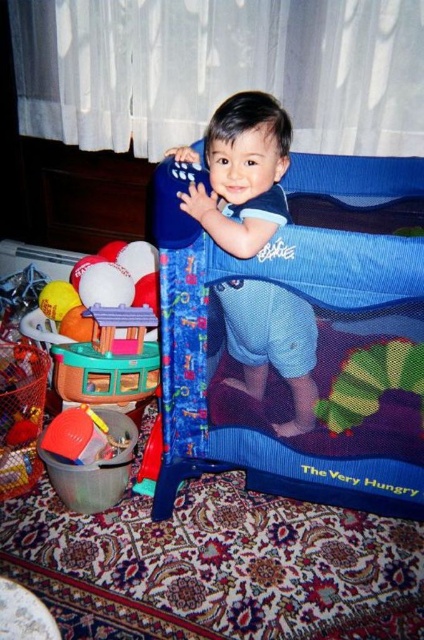
You are a parent trying to choose between the blue fabric playpen at center and the blue mesh playpen at center for your child. Based on the scene description, which playpen offers more space for the child to move around inside?

The blue fabric playpen at center has a larger size compared to the blue mesh playpen at center, so it offers more space for the child to move around inside.

You are a parent trying to clean up the play area. You see the blue fabric playpen at center and the blue mesh playpen at center. Which one is situated lower in the image?

The blue fabric playpen at center is situated lower because it is located below the blue mesh playpen at center.

You are a parent trying to place a new toy in the playpen. The playpen is at the center of the image. Where is the point at coordinates [284,381] located?

The point at coordinates [284,381] is located on the blue fabric playpen at center.